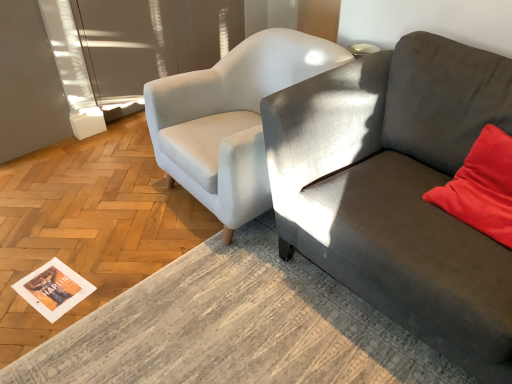
The image size is (512, 384). I want to click on free spot above white paper magazine at lower left (from a real-world perspective), so click(48, 283).